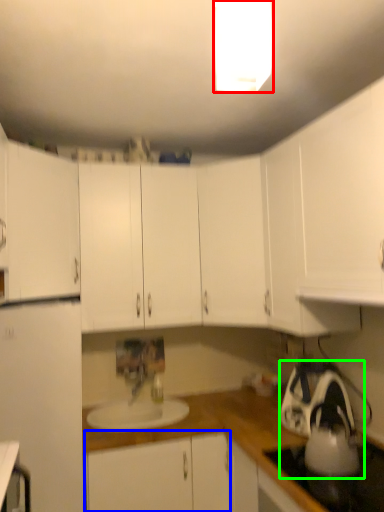
Question: Which is nearer to the light fixture (highlighted by a red box)? cabinetry (highlighted by a blue box) or appliance (highlighted by a green box).

Choices:
 (A) cabinetry
 (B) appliance

Answer: (B)